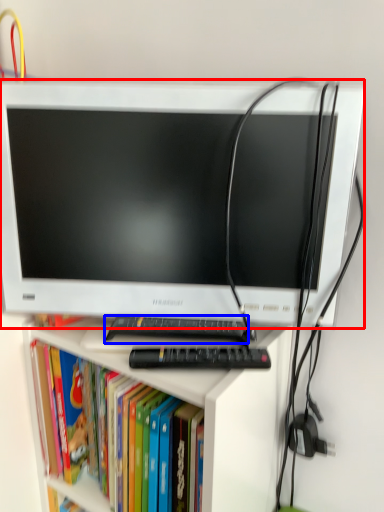
Question: Which object appears closest to the camera in this image, computer monitor (highlighted by a red box) or keyboard (highlighted by a blue box)?

Choices:
 (A) computer monitor
 (B) keyboard

Answer: (A)